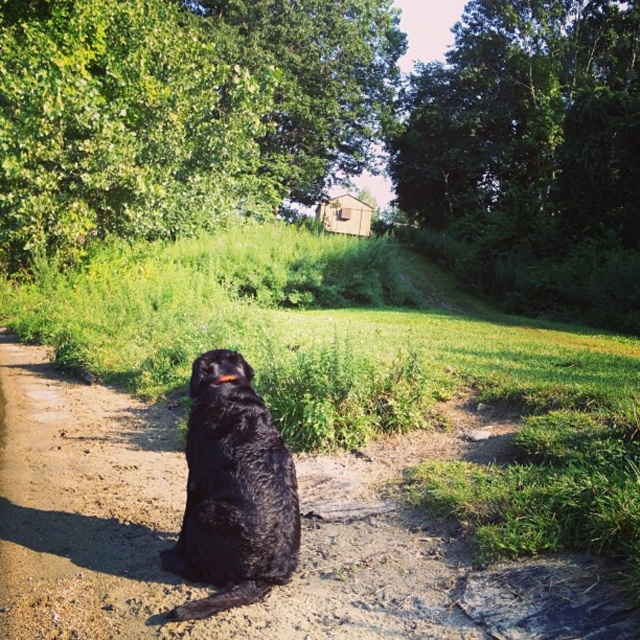
Question: Where is dirt track at center located in relation to shiny black fur at center in the image?

Choices:
 (A) below
 (B) above

Answer: (A)

Question: Which object appears closest to the camera in this image?

Choices:
 (A) shiny black fur at center
 (B) dirt track at center

Answer: (A)

Question: Can you confirm if dirt track at center is positioned below shiny black fur at center?

Choices:
 (A) no
 (B) yes

Answer: (B)

Question: Does dirt track at center appear over shiny black fur at center?

Choices:
 (A) no
 (B) yes

Answer: (A)

Question: Which object appears closest to the camera in this image?

Choices:
 (A) shiny black fur at center
 (B) dirt track at center

Answer: (A)